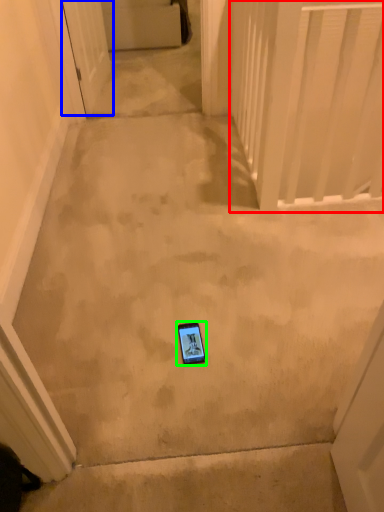
Question: Based on their relative distances, which object is nearer to balustrade (highlighted by a red box)? Choose from door (highlighted by a blue box) and mobile phone (highlighted by a green box).

Choices:
 (A) door
 (B) mobile phone

Answer: (A)